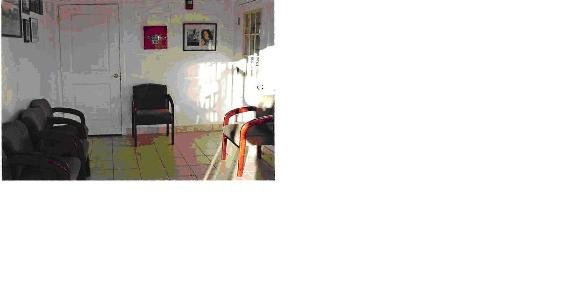
Locate an element on the screen. This screenshot has width=576, height=294. tile floor is located at coordinates (166, 159).